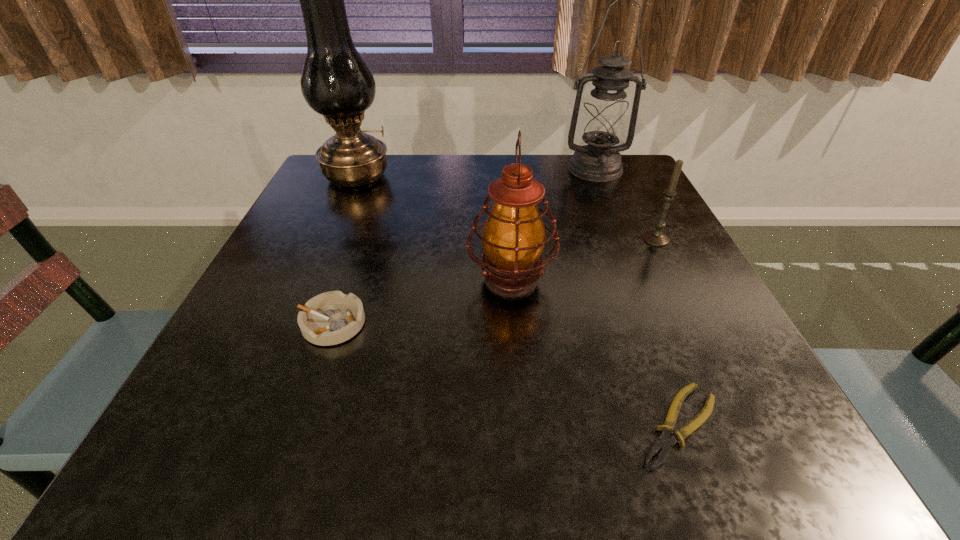
You are a GUI agent. You are given a task and a screenshot of the screen. Output one action in this format:
    pyautogui.click(x=<x>, y=<y>)
    Task: Click on the free region at the near right corner of the desktop
    The height and width of the screenshot is (540, 960).
    Given the screenshot: What is the action you would take?
    (x=759, y=457)

I want to click on free area in between the leftmost oil lamp and the nearest oil lamp, so click(434, 228).

Where is `vacant space that's between the rightmost oil lamp and the second shortest object`? This screenshot has height=540, width=960. vacant space that's between the rightmost oil lamp and the second shortest object is located at coordinates (464, 246).

The height and width of the screenshot is (540, 960). What are the coordinates of `free space between the second shortest object and the nearest object` in the screenshot? It's located at (505, 374).

The image size is (960, 540). I want to click on free space that is in between the shortest oil lamp and the candle, so [584, 259].

The height and width of the screenshot is (540, 960). Identify the location of free spot between the leftmost oil lamp and the rightmost oil lamp. (476, 173).

Where is `free area in between the rightmost oil lamp and the fifth tallest object`? Image resolution: width=960 pixels, height=540 pixels. free area in between the rightmost oil lamp and the fifth tallest object is located at coordinates (464, 246).

You are a GUI agent. You are given a task and a screenshot of the screen. Output one action in this format:
    pyautogui.click(x=<x>, y=<y>)
    Task: Click on the free space between the leftmost oil lamp and the pliers
    The image size is (960, 540).
    Given the screenshot: What is the action you would take?
    pyautogui.click(x=517, y=301)

I want to click on unoccupied area between the nearest object and the rightmost oil lamp, so (636, 298).

Where is `the fourth closest object to the shortest object`? This screenshot has height=540, width=960. the fourth closest object to the shortest object is located at coordinates (604, 118).